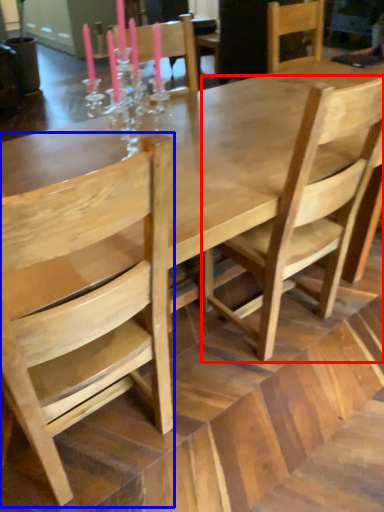
Question: Among these objects, which one is nearest to the camera, chair (highlighted by a red box) or chair (highlighted by a blue box)?

Choices:
 (A) chair
 (B) chair

Answer: (B)